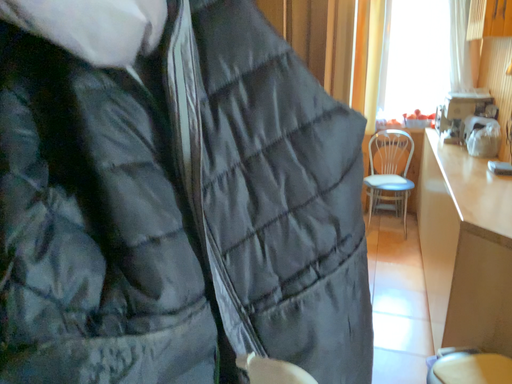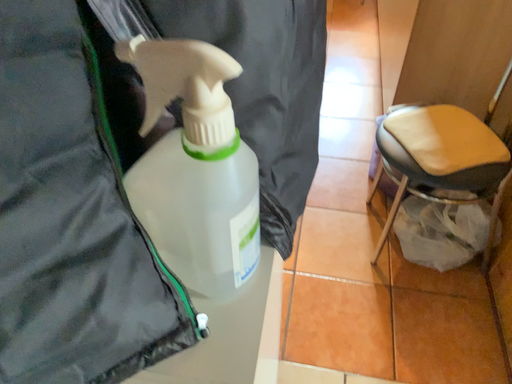
Question: Which way did the camera rotate in the video?

Choices:
 (A) rotated right
 (B) rotated left

Answer: (A)